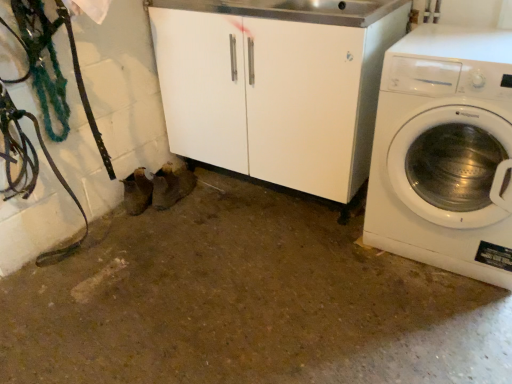
What do you see at coordinates (445, 152) in the screenshot? I see `white glossy washing machine at right` at bounding box center [445, 152].

Locate an element on the screen. This screenshot has width=512, height=384. white glossy washing machine at right is located at coordinates (445, 152).

You are a GUI agent. You are given a task and a screenshot of the screen. Output one action in this format:
    pyautogui.click(x=<x>, y=<y>)
    Task: Click on the white glossy washing machine at right
    The height and width of the screenshot is (384, 512).
    Given the screenshot: What is the action you would take?
    pyautogui.click(x=445, y=152)